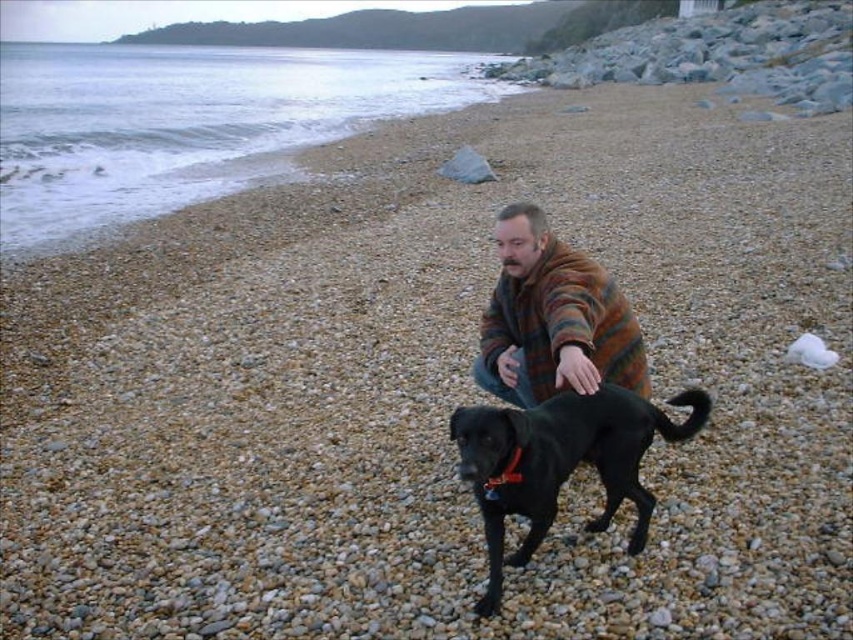
Which is behind, point (717, 61) or point (596, 300)?

Positioned behind is point (717, 61).

Can you confirm if gray rock at upper right is positioned below striped woolen sweater at center?

No.

Identify the location of gray rock at upper right. (717, 54).

Locate an element on the screen. The image size is (853, 640). gray rock at upper right is located at coordinates (717, 54).

Is smooth sand at lower left wider than black matte dog at center?

Indeed, smooth sand at lower left has a greater width compared to black matte dog at center.

Is smooth sand at lower left behind black matte dog at center?

That is True.

The width and height of the screenshot is (853, 640). Identify the location of smooth sand at lower left. pyautogui.click(x=189, y=122).

Is black matte dog at center to the left of gray rock at upper right from the viewer's perspective?

Yes, black matte dog at center is to the left of gray rock at upper right.

Does black matte dog at center have a larger size compared to gray rock at upper right?

Incorrect, black matte dog at center is not larger than gray rock at upper right.

This screenshot has width=853, height=640. Identify the location of black matte dog at center. (560, 461).